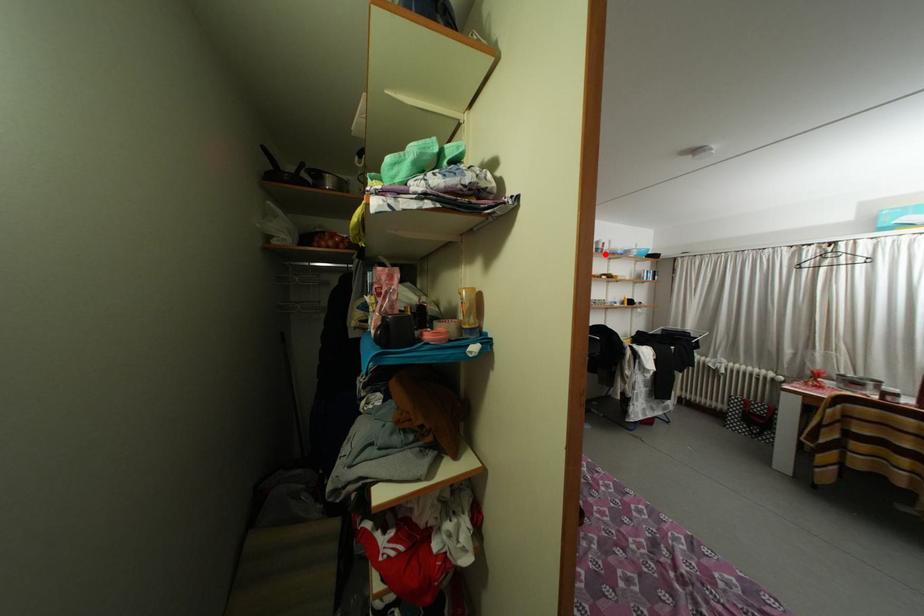
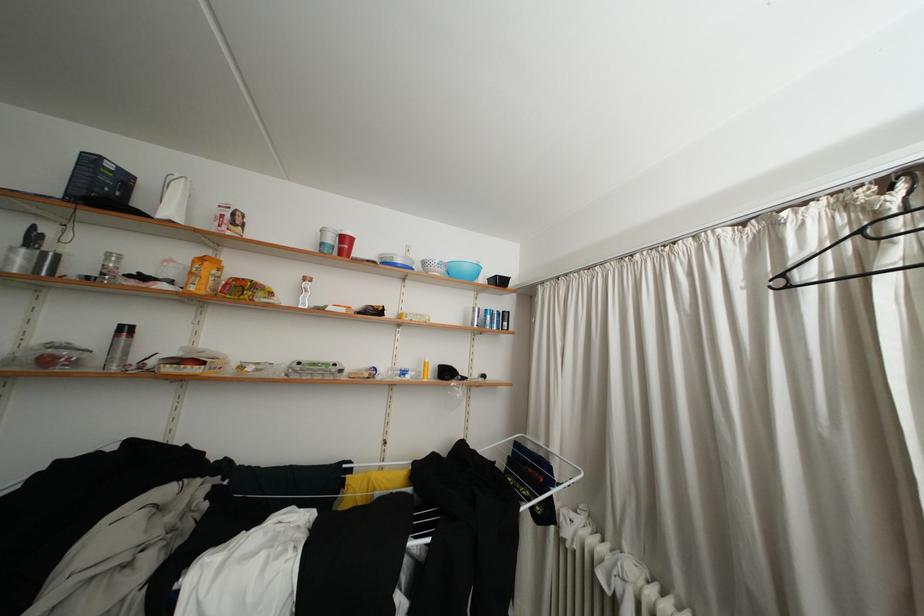
Where in the second image is the point corresponding to the highlighted location from the first image?

(330, 249)